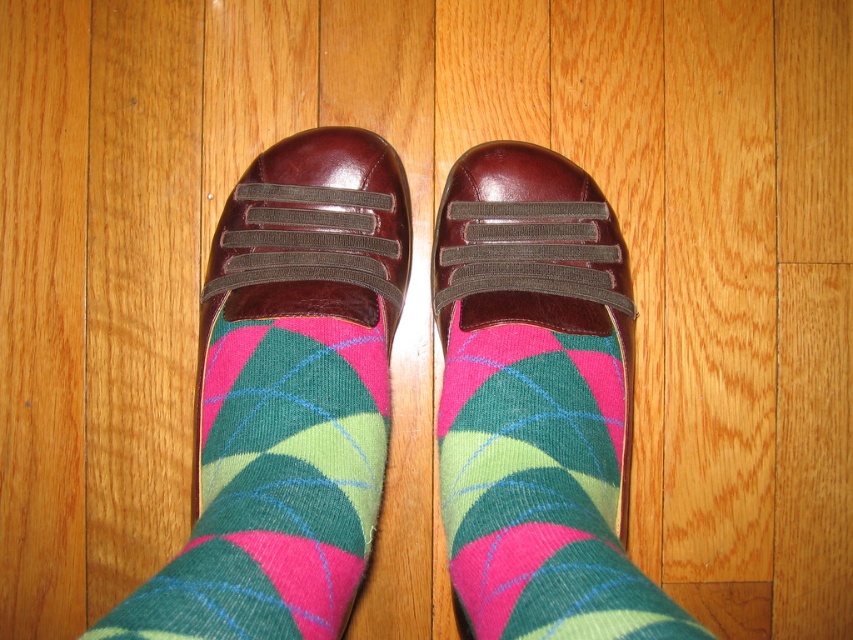
You are trying to put on your socks and shoes. You have a green argyle sock at center and a multicolored knitted sock at center. Which sock should you put on first based on their current positions?

The green argyle sock at center is positioned under the multicolored knitted sock at center, so you should put on the green argyle sock at center first as it is underneath the other sock.